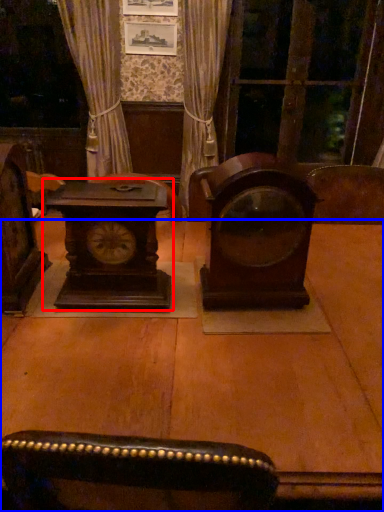
Question: Among these objects, which one is nearest to the camera, alarm clock (highlighted by a red box) or table (highlighted by a blue box)?

Choices:
 (A) alarm clock
 (B) table

Answer: (B)